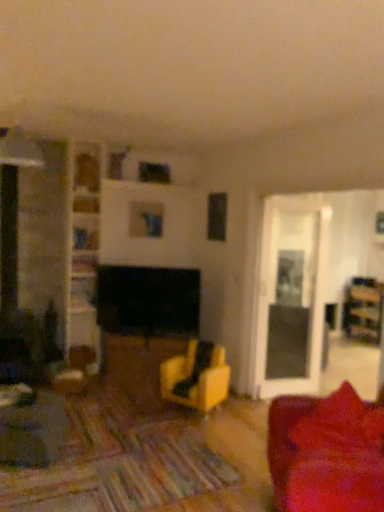
Locate an element on the screen. free spot above wooden bookshelf at left, which is the first shelf from bottom to top (from a real-world perspective) is located at coordinates coord(85,276).